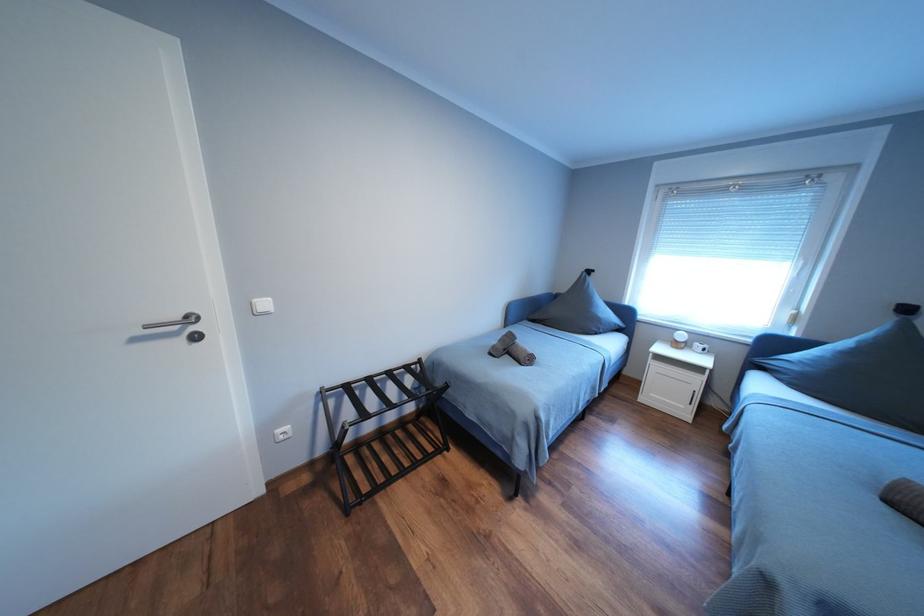
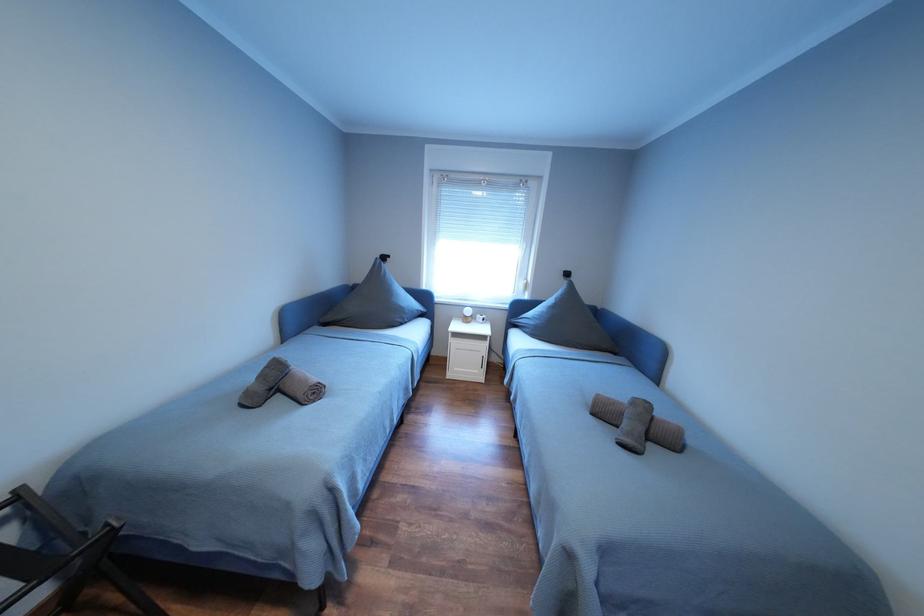
Question: The camera is either moving clockwise (left) or counter-clockwise (right) around the object. The first image is from the beginning of the video and the second image is from the end. Is the camera moving left or right when shooting the video?

Choices:
 (A) Left
 (B) Right

Answer: (A)